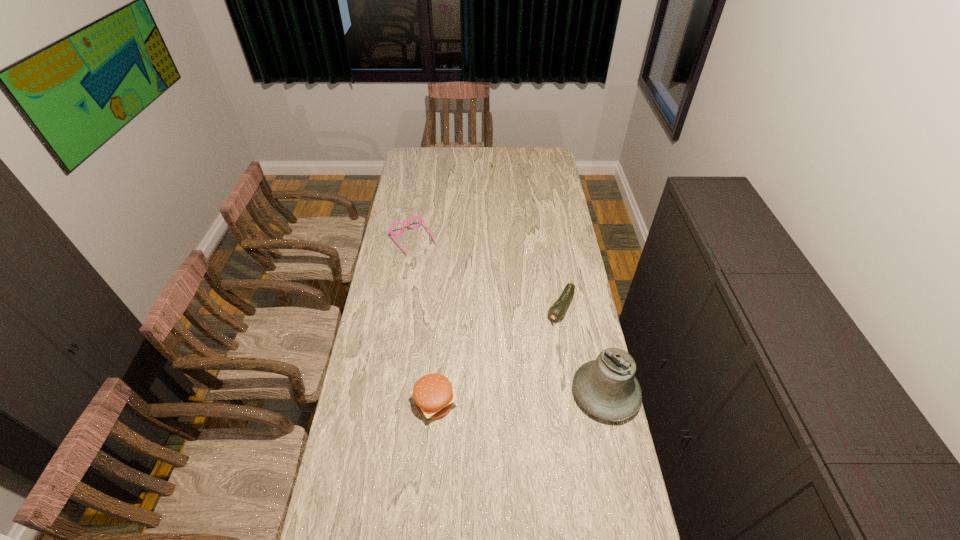
The image size is (960, 540). I want to click on the second tallest object, so click(432, 393).

This screenshot has height=540, width=960. Find the location of `bell`. bell is located at coordinates (607, 388).

At what (x,y) coordinates should I click in order to perform the action: click on the farthest object. Please return your answer as a coordinate pair (x, y). The image size is (960, 540). Looking at the image, I should click on (421, 219).

Locate an element on the screen. The width and height of the screenshot is (960, 540). the third nearest object is located at coordinates (558, 309).

Find the location of a particular element. This screenshot has height=540, width=960. the shortest object is located at coordinates (558, 309).

You are a GUI agent. You are given a task and a screenshot of the screen. Output one action in this format:
    pyautogui.click(x=<x>, y=<y>)
    Task: Click on the free space located on the right of the hamburger
    The image size is (960, 540).
    Given the screenshot: What is the action you would take?
    pyautogui.click(x=553, y=403)

Identify the location of vacant point located 0.230m on the front of the bell. (629, 498).

Find the location of `free space located on the arms of the spectacles`. free space located on the arms of the spectacles is located at coordinates (466, 312).

Find the location of `vacant region located on the arms of the spectacles`. vacant region located on the arms of the spectacles is located at coordinates (453, 294).

At what (x,y) coordinates should I click in order to perform the action: click on vacant area located on the arms of the spectacles. Please return your answer as a coordinate pair (x, y). Looking at the image, I should click on (454, 296).